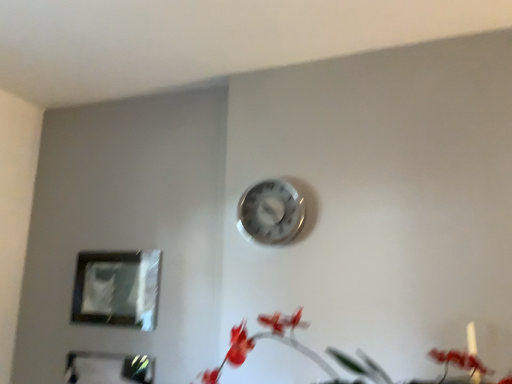
Question: Does matte red flowers at lower right appear on the right side of metallic reflective frame at lower left, placed as the 2th picture frame when sorted from top to bottom?

Choices:
 (A) yes
 (B) no

Answer: (A)

Question: Is matte red flowers at lower right not inside metallic reflective frame at lower left, the 1th picture frame in the bottom-to-top sequence?

Choices:
 (A) yes
 (B) no

Answer: (A)

Question: Is matte red flowers at lower right positioned with its back to metallic reflective frame at lower left, the 1th picture frame in the bottom-to-top sequence?

Choices:
 (A) yes
 (B) no

Answer: (B)

Question: Does matte red flowers at lower right have a smaller size compared to metallic reflective frame at lower left, the 1th picture frame in the bottom-to-top sequence?

Choices:
 (A) yes
 (B) no

Answer: (B)

Question: Does matte red flowers at lower right have a lesser height compared to metallic reflective frame at lower left, placed as the 2th picture frame when sorted from top to bottom?

Choices:
 (A) no
 (B) yes

Answer: (B)

Question: Choose the correct answer: Is metallic silver clock at upper center inside matte plastic picture frame at lower left, which appears as the 2th picture frame when ordered from the bottom, or outside it?

Choices:
 (A) outside
 (B) inside

Answer: (A)

Question: Considering the positions of metallic silver clock at upper center and matte plastic picture frame at lower left, which appears as the 2th picture frame when ordered from the bottom, in the image, is metallic silver clock at upper center wider or thinner than matte plastic picture frame at lower left, which appears as the 2th picture frame when ordered from the bottom,?

Choices:
 (A) wide
 (B) thin

Answer: (A)

Question: Relative to matte plastic picture frame at lower left, the first picture frame positioned from the top, is metallic silver clock at upper center in front or behind?

Choices:
 (A) front
 (B) behind

Answer: (A)

Question: Is point (254, 198) positioned closer to the camera than point (103, 311)?

Choices:
 (A) farther
 (B) closer

Answer: (B)

Question: Looking at the image, does metallic reflective frame at lower left, placed as the 2th picture frame when sorted from top to bottom, seem bigger or smaller compared to metallic silver clock at upper center?

Choices:
 (A) big
 (B) small

Answer: (B)

Question: From their relative heights in the image, would you say metallic reflective frame at lower left, the 1th picture frame in the bottom-to-top sequence, is taller or shorter than metallic silver clock at upper center?

Choices:
 (A) short
 (B) tall

Answer: (B)

Question: From the image's perspective, relative to metallic silver clock at upper center, is metallic reflective frame at lower left, the 1th picture frame in the bottom-to-top sequence, above or below?

Choices:
 (A) above
 (B) below

Answer: (B)

Question: In the image, is metallic reflective frame at lower left, the 1th picture frame in the bottom-to-top sequence, on the left side or the right side of metallic silver clock at upper center?

Choices:
 (A) right
 (B) left

Answer: (B)

Question: In the image, is matte plastic picture frame at lower left, which appears as the 2th picture frame when ordered from the bottom, positioned in front of or behind metallic reflective frame at lower left, placed as the 2th picture frame when sorted from top to bottom?

Choices:
 (A) behind
 (B) front

Answer: (A)

Question: Is matte plastic picture frame at lower left, the first picture frame positioned from the top, wider or thinner than metallic reflective frame at lower left, placed as the 2th picture frame when sorted from top to bottom?

Choices:
 (A) thin
 (B) wide

Answer: (B)